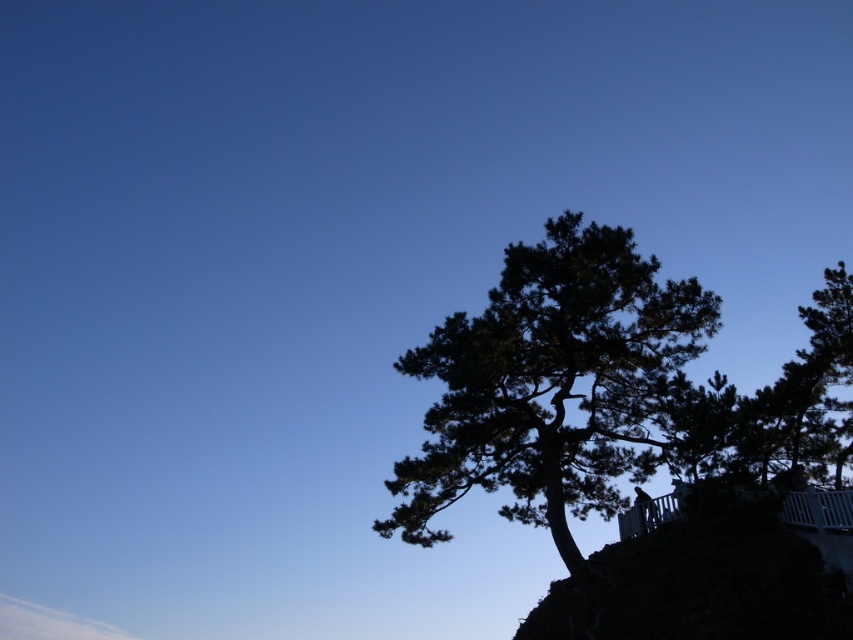
Which is above, dark green textured tree at center or dark green textured tree at upper right?

Positioned higher is dark green textured tree at upper right.

Can you confirm if dark green textured tree at center is taller than dark green textured tree at upper right?

Indeed, dark green textured tree at center has a greater height compared to dark green textured tree at upper right.

Describe the element at coordinates (549, 381) in the screenshot. I see `dark green textured tree at center` at that location.

Where is `dark green textured tree at center`? Image resolution: width=853 pixels, height=640 pixels. dark green textured tree at center is located at coordinates (549, 381).